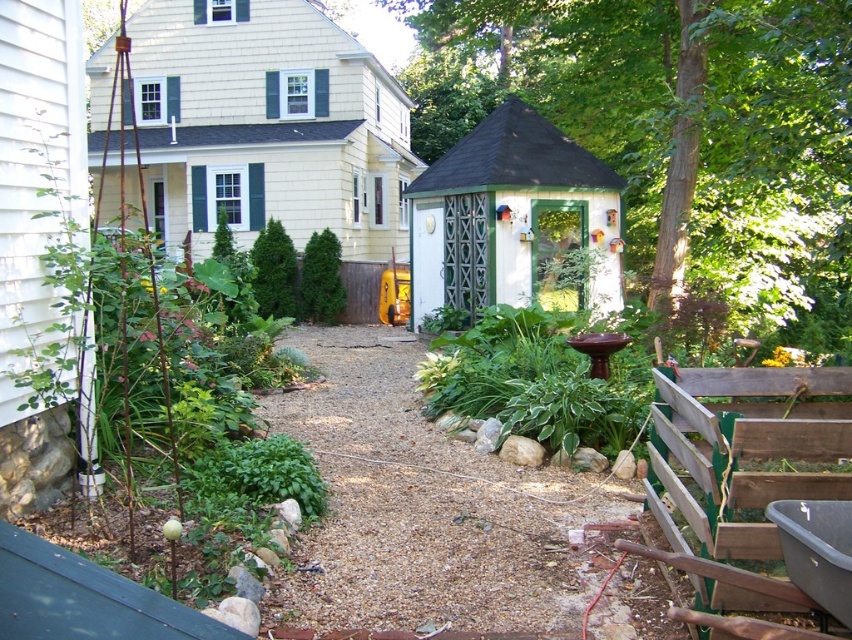
Question: Which point appears farthest from the camera in this image?

Choices:
 (A) (429, 582)
 (B) (320, 304)

Answer: (B)

Question: Estimate the real-world distances between objects in this image. Which object is farther from the green leafy shrub at center?

Choices:
 (A) brown gravel path at center
 (B) white painted wood gazebo at center

Answer: (A)

Question: Observing the image, what is the correct spatial positioning of white painted wood gazebo at center in reference to green leafy shrub at center?

Choices:
 (A) above
 (B) below

Answer: (A)

Question: Can you confirm if white painted wood gazebo at center is positioned below green leafy shrub at center?

Choices:
 (A) no
 (B) yes

Answer: (A)

Question: Is brown gravel path at center closer to camera compared to white painted wood gazebo at center?

Choices:
 (A) yes
 (B) no

Answer: (A)

Question: Which point is closer to the camera?

Choices:
 (A) white painted wood gazebo at center
 (B) green leafy shrub at center

Answer: (A)